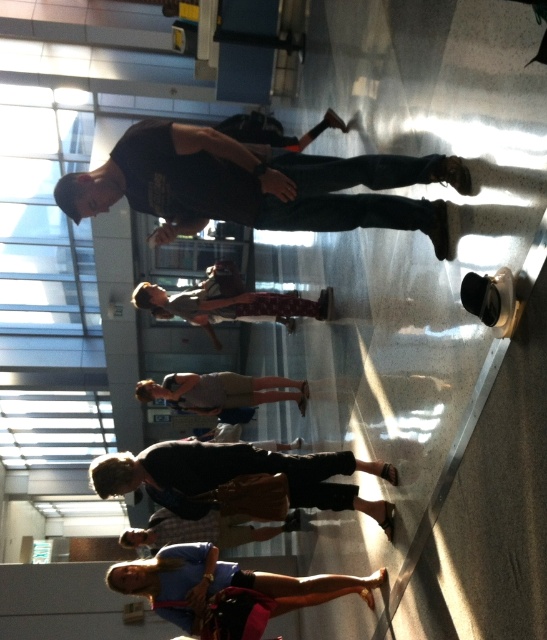
Question: Can you confirm if dark blue jeans at center is wider than dark gray fabric skater at center?

Choices:
 (A) yes
 (B) no

Answer: (A)

Question: Which object is the closest to the dark blue jeans at center?

Choices:
 (A) denim shorts at lower center
 (B) dark gray fabric skater at center

Answer: (B)

Question: Is dark gray fabric skater at center further to camera compared to denim shorts at lower center?

Choices:
 (A) yes
 (B) no

Answer: (B)

Question: Which is nearer to the dark blue jeans at center?

Choices:
 (A) dark gray fabric skater at center
 (B) denim shorts at lower center

Answer: (A)

Question: Observing the image, what is the correct spatial positioning of dark gray fabric skater at center in reference to denim shorts at lower center?

Choices:
 (A) above
 (B) below

Answer: (A)

Question: Which object appears closest to the camera in this image?

Choices:
 (A) denim shorts at lower center
 (B) dark blue jeans at center

Answer: (B)